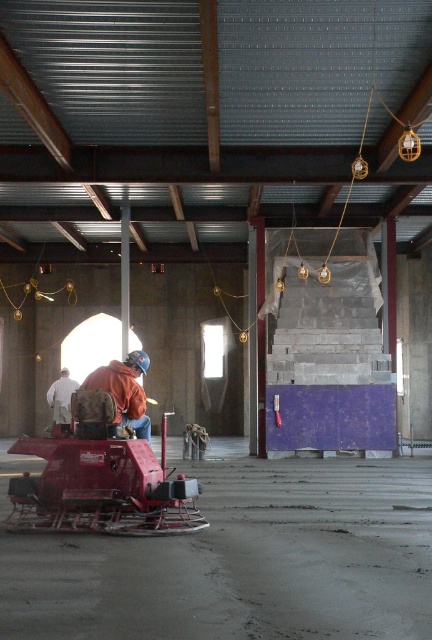
Question: Is brown leather backpack at center closer to the viewer compared to white fabric at center?

Choices:
 (A) no
 (B) yes

Answer: (B)

Question: Where is brown leather backpack at center located in relation to white fabric at center in the image?

Choices:
 (A) right
 (B) left

Answer: (A)

Question: Is the position of brown leather backpack at center less distant than that of white fabric at center?

Choices:
 (A) no
 (B) yes

Answer: (B)

Question: Which point appears closest to the camera in this image?

Choices:
 (A) (64, 404)
 (B) (99, 365)

Answer: (B)

Question: Among these objects, which one is farthest from the camera?

Choices:
 (A) brown leather backpack at center
 (B) white fabric at center

Answer: (B)